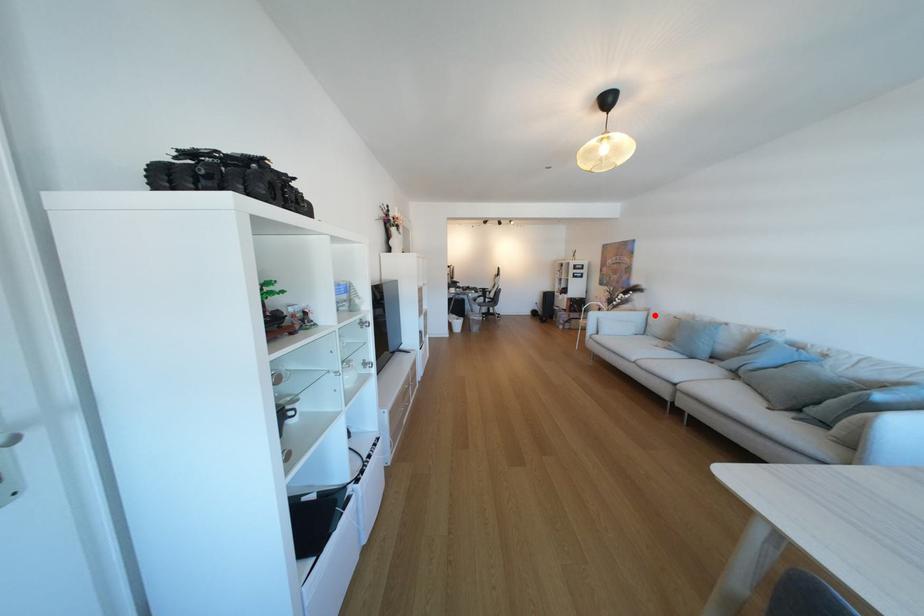
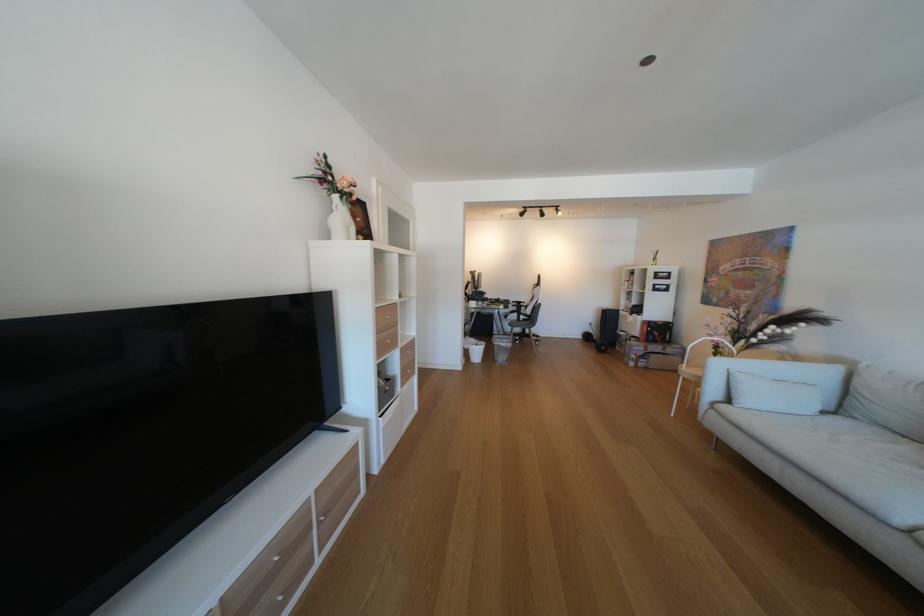
Question: I am providing you with two images of the same scene from different viewpoints. Image1 has a red point marked. In image2, the corresponding 3D location appears at what relative position? Reply with the corresponding letter.

Choices:
 (A) Closer
 (B) Farther

Answer: (B)